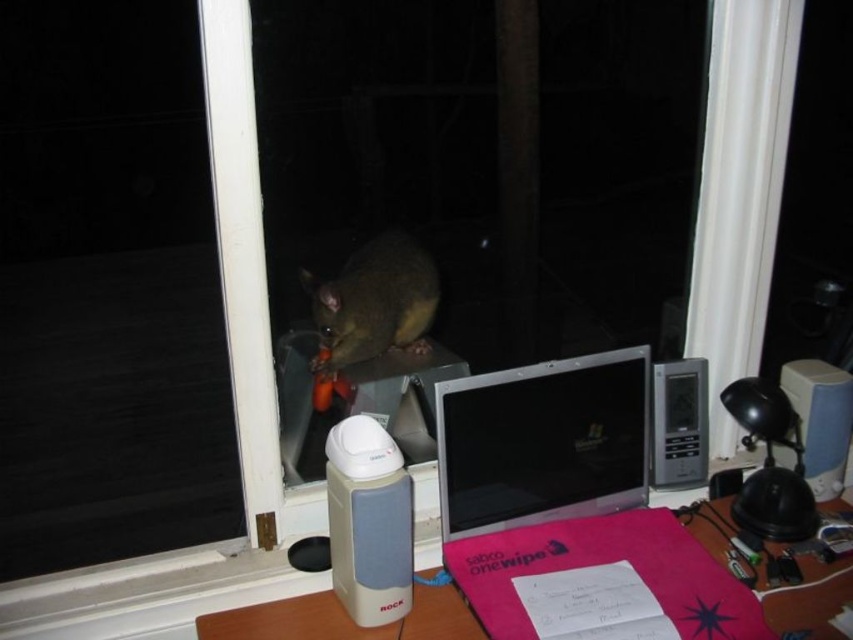
Question: Is silver metallic laptop at center positioned before beige plastic speaker at lower center?

Choices:
 (A) yes
 (B) no

Answer: (B)

Question: Does white plastic speaker at lower left appear under beige plastic speaker at lower center?

Choices:
 (A) yes
 (B) no

Answer: (A)

Question: Which object is the farthest from the beige plastic speaker at lower center?

Choices:
 (A) white plastic speaker at lower left
 (B) silver metallic laptop at center
 (C) brown furry possum at center

Answer: (C)

Question: Which point is farther from the camera taking this photo?

Choices:
 (A) (544, 499)
 (B) (392, 618)
 (C) (773, 604)

Answer: (A)

Question: Can you confirm if silver metallic laptop at center is positioned to the right of beige plastic speaker at lower center?

Choices:
 (A) no
 (B) yes

Answer: (B)

Question: Based on their relative distances, which object is nearer to the white plastic speaker at lower left?

Choices:
 (A) silver metallic laptop at center
 (B) beige plastic speaker at lower center

Answer: (B)